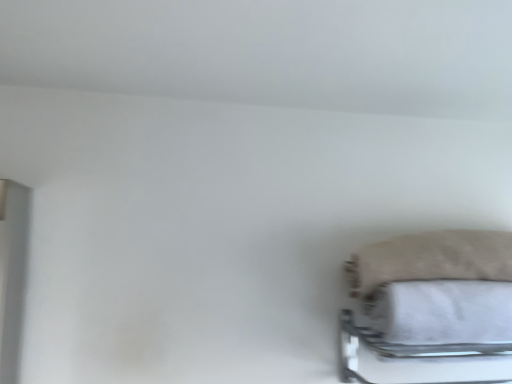
Question: Considering the relative sizes of beige fuzzy pillow at lower right and metallic silver bed frame at lower right in the image provided, is beige fuzzy pillow at lower right wider than metallic silver bed frame at lower right?

Choices:
 (A) yes
 (B) no

Answer: (B)

Question: From a real-world perspective, is beige fuzzy pillow at lower right positioned under metallic silver bed frame at lower right based on gravity?

Choices:
 (A) no
 (B) yes

Answer: (A)

Question: Is beige fuzzy pillow at lower right located outside metallic silver bed frame at lower right?

Choices:
 (A) no
 (B) yes

Answer: (B)

Question: Can you confirm if beige fuzzy pillow at lower right is taller than metallic silver bed frame at lower right?

Choices:
 (A) no
 (B) yes

Answer: (A)

Question: Is beige fuzzy pillow at lower right beside metallic silver bed frame at lower right?

Choices:
 (A) no
 (B) yes

Answer: (A)

Question: Considering the relative positions of white fabric bath towel at lower right and metallic silver bed frame at lower right in the image provided, is white fabric bath towel at lower right to the left or to the right of metallic silver bed frame at lower right?

Choices:
 (A) right
 (B) left

Answer: (A)

Question: Would you say white fabric bath towel at lower right is inside or outside metallic silver bed frame at lower right?

Choices:
 (A) outside
 (B) inside

Answer: (B)

Question: From the image's perspective, is white fabric bath towel at lower right above or below metallic silver bed frame at lower right?

Choices:
 (A) above
 (B) below

Answer: (A)

Question: In the image, is white fabric bath towel at lower right positioned in front of or behind metallic silver bed frame at lower right?

Choices:
 (A) behind
 (B) front

Answer: (A)

Question: From the image's perspective, is metallic silver bed frame at lower right located above or below white fabric bath towel at lower right?

Choices:
 (A) above
 (B) below

Answer: (B)

Question: Considering the positions of metallic silver bed frame at lower right and white fabric bath towel at lower right in the image, is metallic silver bed frame at lower right bigger or smaller than white fabric bath towel at lower right?

Choices:
 (A) small
 (B) big

Answer: (B)

Question: In terms of width, does metallic silver bed frame at lower right look wider or thinner when compared to white fabric bath towel at lower right?

Choices:
 (A) wide
 (B) thin

Answer: (A)

Question: Is metallic silver bed frame at lower right taller or shorter than white fabric bath towel at lower right?

Choices:
 (A) short
 (B) tall

Answer: (B)

Question: In the image, is white fabric bath towel at lower right on the left side or the right side of beige fuzzy pillow at lower right?

Choices:
 (A) right
 (B) left

Answer: (A)

Question: Considering the positions of white fabric bath towel at lower right and beige fuzzy pillow at lower right in the image, is white fabric bath towel at lower right wider or thinner than beige fuzzy pillow at lower right?

Choices:
 (A) wide
 (B) thin

Answer: (B)